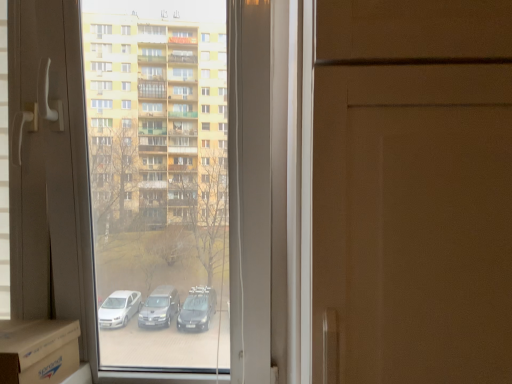
What are the coordinates of `cardboard at lower left` in the screenshot? It's located at (38, 350).

The height and width of the screenshot is (384, 512). What do you see at coordinates (38, 350) in the screenshot?
I see `cardboard at lower left` at bounding box center [38, 350].

Find the location of `transparent glass window at center`. transparent glass window at center is located at coordinates (233, 166).

What do you see at coordinates (233, 166) in the screenshot? The height and width of the screenshot is (384, 512). I see `transparent glass window at center` at bounding box center [233, 166].

The height and width of the screenshot is (384, 512). What are the coordinates of `cardboard at lower left` in the screenshot? It's located at (38, 350).

Looking at this image, visually, is transparent glass window at center positioned to the left or to the right of cardboard at lower left?

transparent glass window at center is to the right of cardboard at lower left.

Is transparent glass window at center behind cardboard at lower left?

Yes, the depth of transparent glass window at center is greater than that of cardboard at lower left.

Which point is more forward, (x=282, y=8) or (x=37, y=342)?

Positioned in front is point (x=37, y=342).

From the image's perspective, between transparent glass window at center and cardboard at lower left, which one is located above?

transparent glass window at center, from the image's perspective.

From a real-world perspective, is transparent glass window at center positioned over cardboard at lower left based on gravity?

Yes.

Does transparent glass window at center have a greater width compared to cardboard at lower left?

In fact, transparent glass window at center might be narrower than cardboard at lower left.

Considering the sizes of objects transparent glass window at center and cardboard at lower left in the image provided, who is shorter, transparent glass window at center or cardboard at lower left?

Standing shorter between the two is cardboard at lower left.

Who is bigger, transparent glass window at center or cardboard at lower left?

With larger size is transparent glass window at center.

Is transparent glass window at center located outside cardboard at lower left?

Indeed, transparent glass window at center is completely outside cardboard at lower left.

Is transparent glass window at center not close to cardboard at lower left?

No, transparent glass window at center is in close proximity to cardboard at lower left.

Is cardboard at lower left at the back of transparent glass window at center?

Yes.

What's the angular difference between transparent glass window at center and cardboard at lower left's facing directions?

5.5 degrees.

Where is `cardboard box on the left side of transparent glass window at center`? Image resolution: width=512 pixels, height=384 pixels. cardboard box on the left side of transparent glass window at center is located at coordinates (38, 350).

Visually, is cardboard at lower left positioned to the left or to the right of transparent glass window at center?

In the image, cardboard at lower left appears on the left side of transparent glass window at center.

Who is more distant, cardboard at lower left or transparent glass window at center?

transparent glass window at center.

Is point (10, 381) closer to camera compared to point (47, 185)?

Yes, point (10, 381) is in front of point (47, 185).

From the image's perspective, is cardboard at lower left over transparent glass window at center?

Incorrect, from the image's perspective, cardboard at lower left is lower than transparent glass window at center.

From a real-world perspective, is cardboard at lower left above or below transparent glass window at center?

Clearly, from a real-world perspective, cardboard at lower left is below transparent glass window at center.

Considering the sizes of objects cardboard at lower left and transparent glass window at center in the image provided, who is wider, cardboard at lower left or transparent glass window at center?

With larger width is cardboard at lower left.

Considering the sizes of cardboard at lower left and transparent glass window at center in the image, is cardboard at lower left taller or shorter than transparent glass window at center?

cardboard at lower left is shorter than transparent glass window at center.

Between cardboard at lower left and transparent glass window at center, which one has larger size?

Bigger between the two is transparent glass window at center.

Can transparent glass window at center be found inside cardboard at lower left?

No, transparent glass window at center is not inside cardboard at lower left.

Is cardboard at lower left in contact with transparent glass window at center?

cardboard at lower left is not next to transparent glass window at center, and they're not touching.

Is cardboard at lower left facing towards transparent glass window at center?

A: Yes, cardboard at lower left is turned towards transparent glass window at center.

At what (x,y) coordinates should I click in order to perform the action: click on cardboard box below the transparent glass window at center (from a real-world perspective). Please return your answer as a coordinate pair (x, y). This screenshot has width=512, height=384. Looking at the image, I should click on (38, 350).

At what (x,y) coordinates should I click in order to perform the action: click on window on the right of cardboard at lower left. Please return your answer as a coordinate pair (x, y). The height and width of the screenshot is (384, 512). Looking at the image, I should click on coord(233,166).

There is a cardboard at lower left. Where is `window above it (from a real-world perspective)`? window above it (from a real-world perspective) is located at coordinates (233, 166).